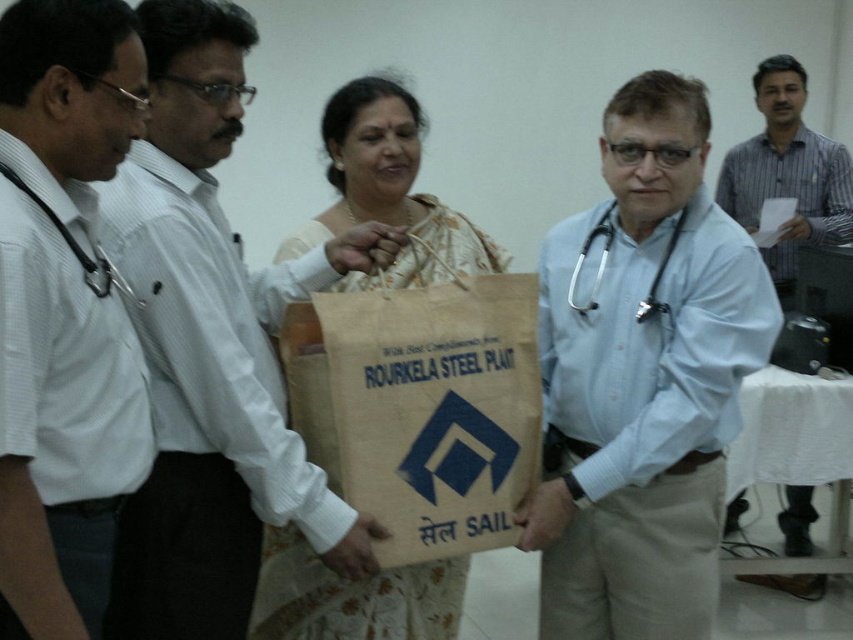
You are a photographer at the event and need to position yourself to capture the beige fabric saree at center in the frame. What are the coordinates where you should aim your camera?

The beige fabric saree at center is located at coordinates point (389, 189). You should aim your camera at those coordinates to capture it.

You are a photographer trying to capture a clear shot of the brown paper bag at center and the matte black stethoscope at left. Since the stethoscope is partially obscured, can you adjust your position to see both objects fully without moving them?

The matte black stethoscope at left is behind the brown paper bag at center, so moving your position slightly to the side might allow you to see both objects fully without obstruction.

You are a photographer standing at a certain distance from the brown paper bag at center. You need to capture a clear photo of the bag without any distortion. The camera you are using has a minimum focusing distance of 1.5 meters. Will you be able to take the photo without moving closer?

The distance between the brown paper bag at center and the camera is 1.49 meters. Since the camera requires a minimum focusing distance of 1.5 meters, you are slightly too close to focus properly. Move back a small distance to ensure the camera can focus clearly.